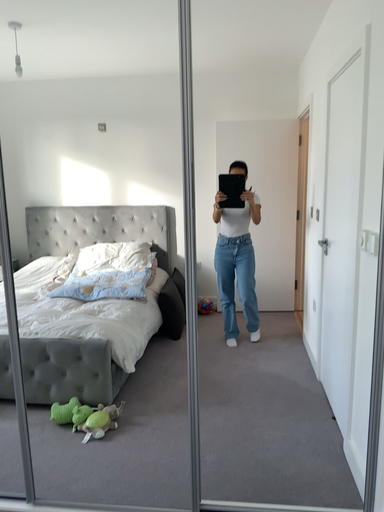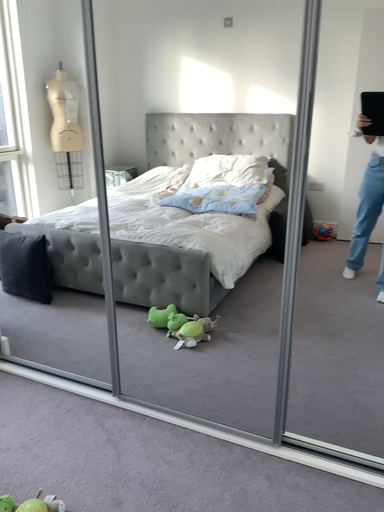
Question: How did the camera likely rotate when shooting the video?

Choices:
 (A) rotated right
 (B) rotated left

Answer: (B)